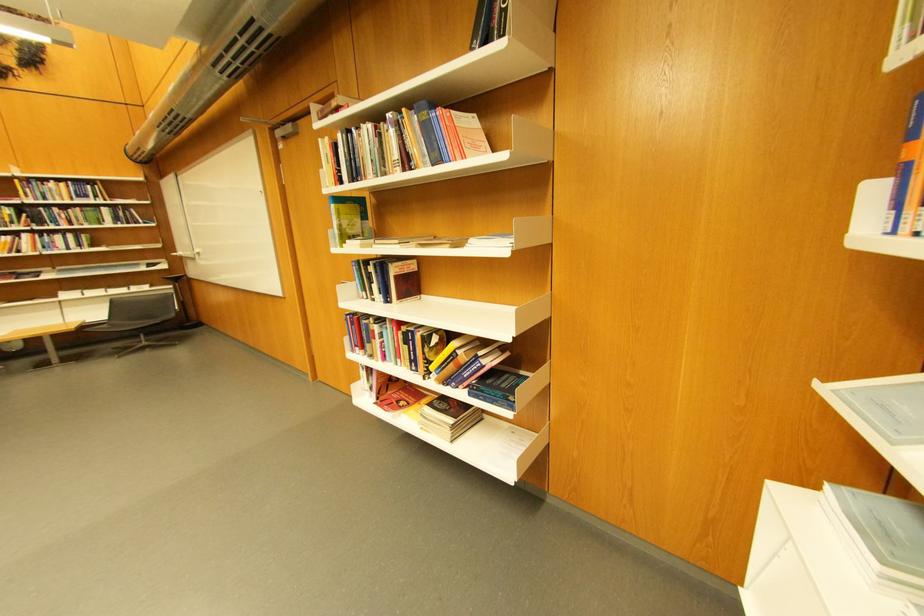
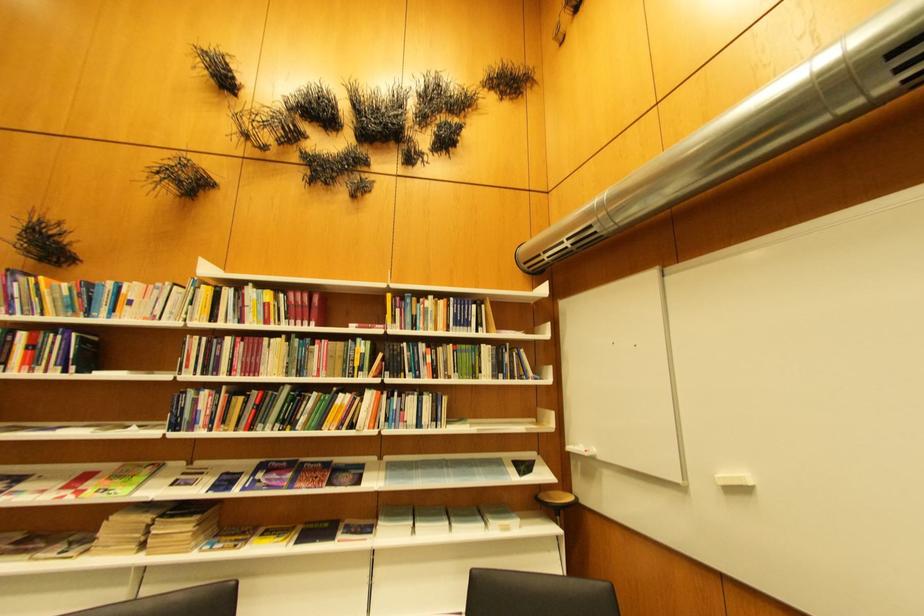
Find the pixel in the second image that matches (116,292) in the first image.

(460, 527)